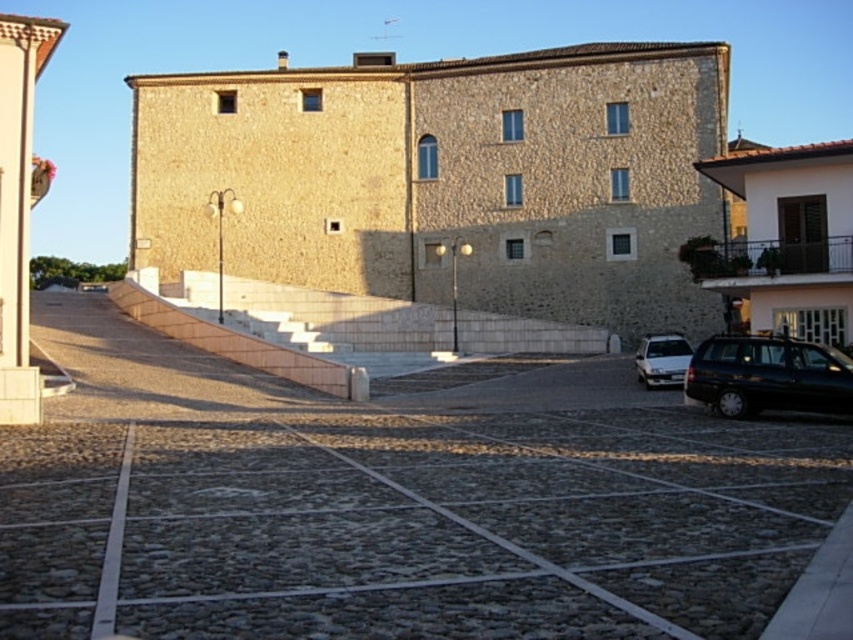
You are standing at the entrance of the building and want to walk to the metallic black balustrade at upper right. Which direction should you go from the cobblestone parking lot at center?

You should go to the right from the cobblestone parking lot at center to reach the metallic black balustrade at upper right because the cobblestone parking lot at center is located to the left of the metallic black balustrade at upper right.

You are a delivery person trying to park your silver metallic sedan at lower right in the cobblestone parking lot at center. Can you park your car there if the parking lot is to the left of your car?

The cobblestone parking lot at center is to the left of the silver metallic sedan at lower right, so the car is already positioned to the right of the parking area. To park, you would need to move the car to the left towards the parking lot.